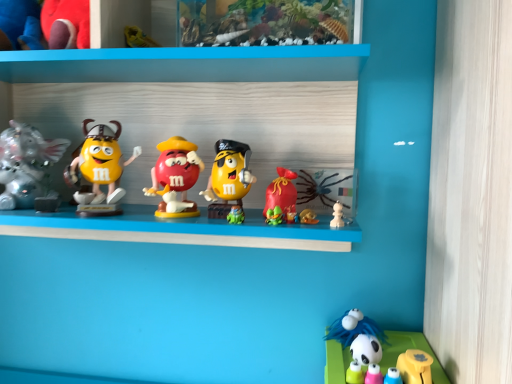
Question: Is silver metallic elephant at left, which is the 6th toy from right to left, bigger than matte plastic m&m figure at center, the fourth toy when ordered from left to right?

Choices:
 (A) yes
 (B) no

Answer: (A)

Question: Can you confirm if silver metallic elephant at left, the 2th toy when ordered from left to right, is smaller than matte plastic m&m figure at center, arranged as the 4th toy when viewed from the right?

Choices:
 (A) no
 (B) yes

Answer: (A)

Question: Considering the relative positions of silver metallic elephant at left, the 2th toy when ordered from left to right, and matte plastic m&m figure at center, arranged as the 4th toy when viewed from the right, in the image provided, is silver metallic elephant at left, the 2th toy when ordered from left to right, in front of matte plastic m&m figure at center, arranged as the 4th toy when viewed from the right,?

Choices:
 (A) no
 (B) yes

Answer: (A)

Question: Does silver metallic elephant at left, the 2th toy when ordered from left to right, appear on the right side of matte plastic m&m figure at center, arranged as the 4th toy when viewed from the right?

Choices:
 (A) yes
 (B) no

Answer: (B)

Question: Would you say matte plastic m&m figure at center, arranged as the 4th toy when viewed from the right, is part of silver metallic elephant at left, the 2th toy when ordered from left to right,'s contents?

Choices:
 (A) no
 (B) yes

Answer: (A)

Question: Is matte yellow plastic m&m at center, the 5th toy viewed from the left, taller or shorter than velvet plush toy at upper left, which is counted as the seventh toy, starting from the right?

Choices:
 (A) short
 (B) tall

Answer: (A)

Question: Looking at their shapes, would you say matte yellow plastic m&m at center, the 3th toy when ordered from right to left, is wider or thinner than velvet plush toy at upper left, which appears as the 1th toy when viewed from the left?

Choices:
 (A) thin
 (B) wide

Answer: (A)

Question: From a real-world perspective, relative to velvet plush toy at upper left, which is counted as the seventh toy, starting from the right, is matte yellow plastic m&m at center, the 3th toy when ordered from right to left, vertically above or below?

Choices:
 (A) above
 (B) below

Answer: (B)

Question: Is point (236, 150) closer or farther from the camera than point (53, 26)?

Choices:
 (A) closer
 (B) farther

Answer: (B)

Question: Is matte yellow figurine at left, acting as the third toy starting from the left, taller or shorter than matte plastic m&m figure at center, arranged as the 4th toy when viewed from the right?

Choices:
 (A) short
 (B) tall

Answer: (B)

Question: In the image, is matte yellow figurine at left, acting as the third toy starting from the left, on the left side or the right side of matte plastic m&m figure at center, the fourth toy when ordered from left to right?

Choices:
 (A) right
 (B) left

Answer: (B)

Question: Is matte yellow figurine at left, acting as the third toy starting from the left, wider or thinner than matte plastic m&m figure at center, the fourth toy when ordered from left to right?

Choices:
 (A) wide
 (B) thin

Answer: (B)

Question: Considering the positions of point (108, 182) and point (182, 165), is point (108, 182) closer or farther from the camera than point (182, 165)?

Choices:
 (A) farther
 (B) closer

Answer: (A)

Question: In terms of height, does matte plastic m&m figure at center, the fourth toy when ordered from left to right, look taller or shorter compared to silver metallic elephant at left, which is the 6th toy from right to left?

Choices:
 (A) tall
 (B) short

Answer: (B)

Question: Looking at the image, does matte plastic m&m figure at center, arranged as the 4th toy when viewed from the right, seem bigger or smaller compared to silver metallic elephant at left, the 2th toy when ordered from left to right?

Choices:
 (A) small
 (B) big

Answer: (A)